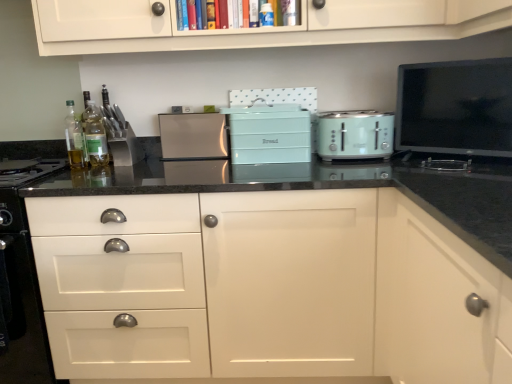
Question: From a real-world perspective, is mint green plastic toaster at center, the 1th kitchen appliance viewed from the right, over white glossy drawer at lower left?

Choices:
 (A) no
 (B) yes

Answer: (B)

Question: Is the depth of mint green plastic toaster at center, the 2th kitchen appliance when ordered from back to front, less than that of white glossy drawer at lower left?

Choices:
 (A) no
 (B) yes

Answer: (A)

Question: Does mint green plastic toaster at center, the 1th kitchen appliance viewed from the right, have a smaller size compared to white glossy drawer at lower left?

Choices:
 (A) yes
 (B) no

Answer: (A)

Question: Would you say mint green plastic toaster at center, marked as the first kitchen appliance in a front-to-back arrangement, contains white glossy drawer at lower left?

Choices:
 (A) no
 (B) yes

Answer: (A)

Question: Would you say mint green plastic toaster at center, the second kitchen appliance in the left-to-right sequence, is outside white glossy drawer at lower left?

Choices:
 (A) yes
 (B) no

Answer: (A)

Question: Is white glossy drawer at lower left at the back of mint green plastic toaster at center, the 1th kitchen appliance viewed from the right?

Choices:
 (A) no
 (B) yes

Answer: (A)

Question: Is black glossy tv at upper right, the 1th appliance in the right-to-left sequence, oriented towards mint green plastic toaster at center, the 2th kitchen appliance when ordered from back to front?

Choices:
 (A) no
 (B) yes

Answer: (A)

Question: Is black glossy tv at upper right, the 1th appliance in the right-to-left sequence, facing away from mint green plastic toaster at center, the second kitchen appliance in the left-to-right sequence?

Choices:
 (A) yes
 (B) no

Answer: (B)

Question: Is there a large distance between black glossy tv at upper right, the 1th appliance in the right-to-left sequence, and mint green plastic toaster at center, the 2th kitchen appliance when ordered from back to front?

Choices:
 (A) no
 (B) yes

Answer: (A)

Question: Is black glossy tv at upper right, the 1th appliance in the right-to-left sequence, closer to the viewer compared to mint green plastic toaster at center, marked as the first kitchen appliance in a front-to-back arrangement?

Choices:
 (A) yes
 (B) no

Answer: (A)

Question: Considering the relative sizes of black glossy tv at upper right, the 1th appliance in the right-to-left sequence, and mint green plastic toaster at center, marked as the first kitchen appliance in a front-to-back arrangement, in the image provided, is black glossy tv at upper right, the 1th appliance in the right-to-left sequence, thinner than mint green plastic toaster at center, marked as the first kitchen appliance in a front-to-back arrangement,?

Choices:
 (A) yes
 (B) no

Answer: (A)

Question: Does black glossy tv at upper right, the 1th appliance in the right-to-left sequence, appear on the left side of mint green plastic toaster at center, marked as the first kitchen appliance in a front-to-back arrangement?

Choices:
 (A) no
 (B) yes

Answer: (A)

Question: Is matte teal bread bin at center, the second appliance in the right-to-left sequence, surrounded by mint green plastic toaster at center, marked as the first kitchen appliance in a front-to-back arrangement?

Choices:
 (A) yes
 (B) no

Answer: (B)